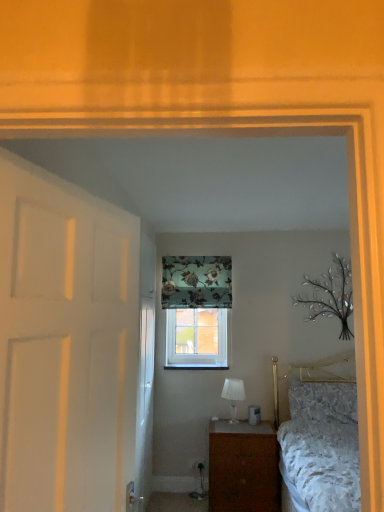
Question: Is the depth of clear glass window at center greater than that of white glass table lamp at center?

Choices:
 (A) yes
 (B) no

Answer: (A)

Question: Can you confirm if clear glass window at center is positioned to the left of white glass table lamp at center?

Choices:
 (A) yes
 (B) no

Answer: (A)

Question: From the image's perspective, is clear glass window at center below white glass table lamp at center?

Choices:
 (A) no
 (B) yes

Answer: (A)

Question: From the image's perspective, would you say clear glass window at center is positioned over white glass table lamp at center?

Choices:
 (A) yes
 (B) no

Answer: (A)

Question: From a real-world perspective, is clear glass window at center positioned under white glass table lamp at center based on gravity?

Choices:
 (A) yes
 (B) no

Answer: (B)

Question: Is brown wood nightstand at lower right taller or shorter than fluffy white pillow at lower right?

Choices:
 (A) tall
 (B) short

Answer: (A)

Question: Is brown wood nightstand at lower right inside or outside of fluffy white pillow at lower right?

Choices:
 (A) outside
 (B) inside

Answer: (A)

Question: Visually, is brown wood nightstand at lower right positioned to the left or to the right of fluffy white pillow at lower right?

Choices:
 (A) right
 (B) left

Answer: (B)

Question: From a real-world perspective, relative to fluffy white pillow at lower right, is brown wood nightstand at lower right vertically above or below?

Choices:
 (A) below
 (B) above

Answer: (A)

Question: In terms of width, does clear glass window at center look wider or thinner when compared to white matte door at left, the 2th door when ordered from back to front?

Choices:
 (A) wide
 (B) thin

Answer: (B)

Question: Is point (200, 310) closer or farther from the camera than point (107, 424)?

Choices:
 (A) closer
 (B) farther

Answer: (B)

Question: Relative to white matte door at left, positioned as the 1th door in front-to-back order, is clear glass window at center in front or behind?

Choices:
 (A) front
 (B) behind

Answer: (B)

Question: In terms of height, does clear glass window at center look taller or shorter compared to white matte door at left, positioned as the 1th door in front-to-back order?

Choices:
 (A) tall
 (B) short

Answer: (B)

Question: Considering the relative positions of white glass table lamp at center and floral fabric curtain at upper center in the image provided, is white glass table lamp at center to the left or to the right of floral fabric curtain at upper center?

Choices:
 (A) right
 (B) left

Answer: (A)

Question: Looking at their shapes, would you say white glass table lamp at center is wider or thinner than floral fabric curtain at upper center?

Choices:
 (A) thin
 (B) wide

Answer: (B)